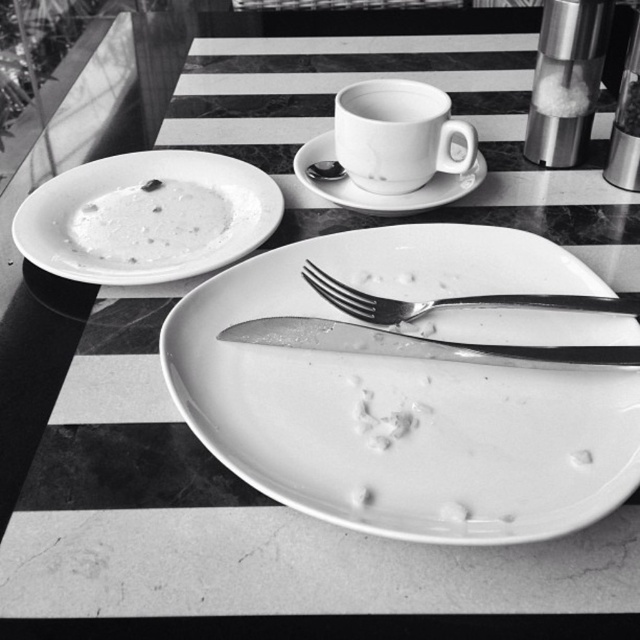
Is white ceramic mug at upper center in front of shiny metal spoon at upper center?

Yes.

Between white ceramic mug at upper center and shiny metal spoon at upper center, which one appears on the right side from the viewer's perspective?

white ceramic mug at upper center

Find the location of `white ceramic mug at upper center`. white ceramic mug at upper center is located at coordinates (397, 134).

Can you confirm if white glossy plate at center is shorter than metallic silver pepper grinder at upper right?

Incorrect, white glossy plate at center's height does not fall short of metallic silver pepper grinder at upper right's.

Who is lower down, white glossy plate at center or metallic silver pepper grinder at upper right?

Positioned lower is white glossy plate at center.

Identify the location of white glossy plate at center. (404, 396).

Which is more to the right, white matte plate at center or polished silver fork at center?

From the viewer's perspective, polished silver fork at center appears more on the right side.

Is white matte plate at center to the left of polished silver fork at center from the viewer's perspective?

Indeed, white matte plate at center is positioned on the left side of polished silver fork at center.

Where is `white matte plate at center`? This screenshot has width=640, height=640. white matte plate at center is located at coordinates (378, 193).